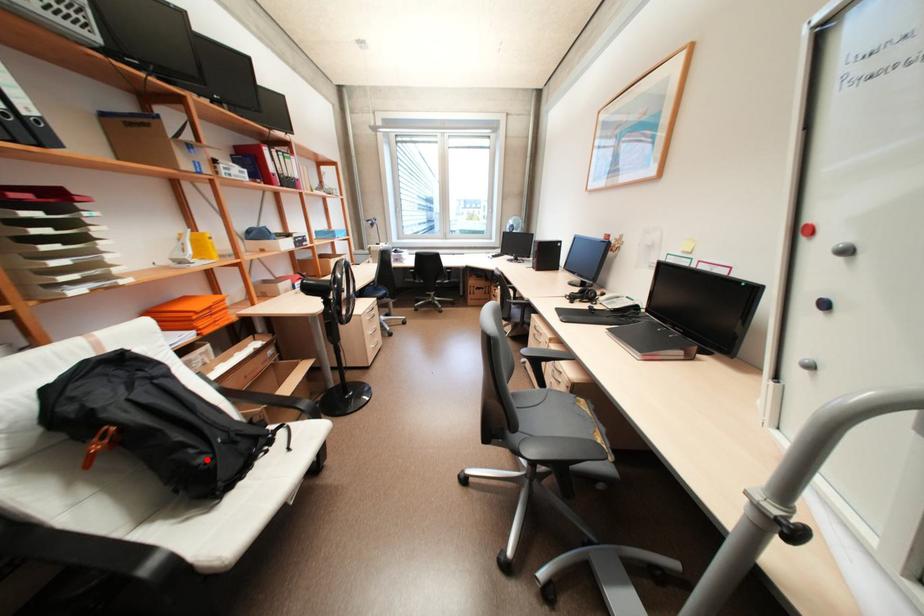
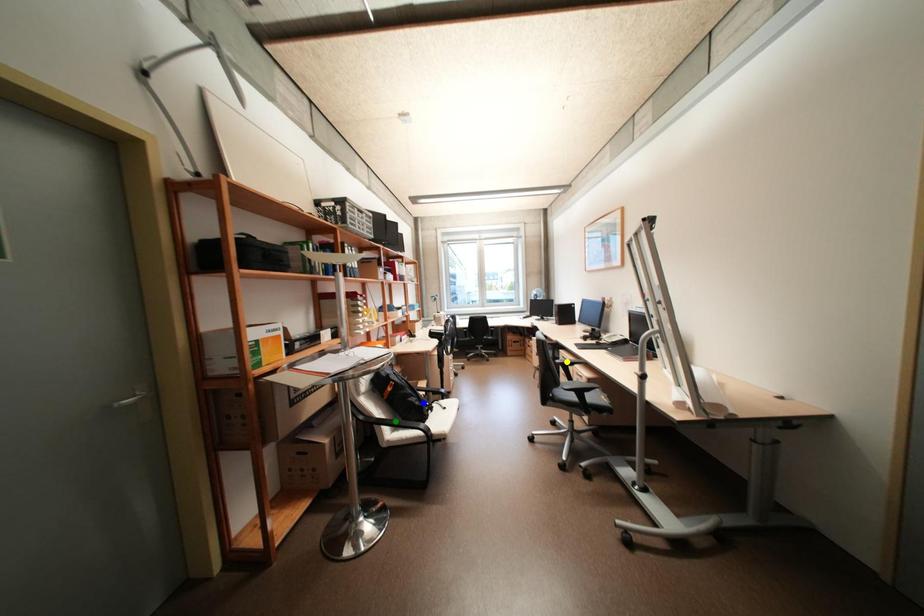
Question: I am providing you with two images of the same scene from different viewpoints. A red point is marked on the first image. You are given multiple points on the second image. Which point in image 2 is actually the same real-world point as the red point in image 1?

Choices:
 (A) blue point
 (B) green point
 (C) yellow point

Answer: (A)